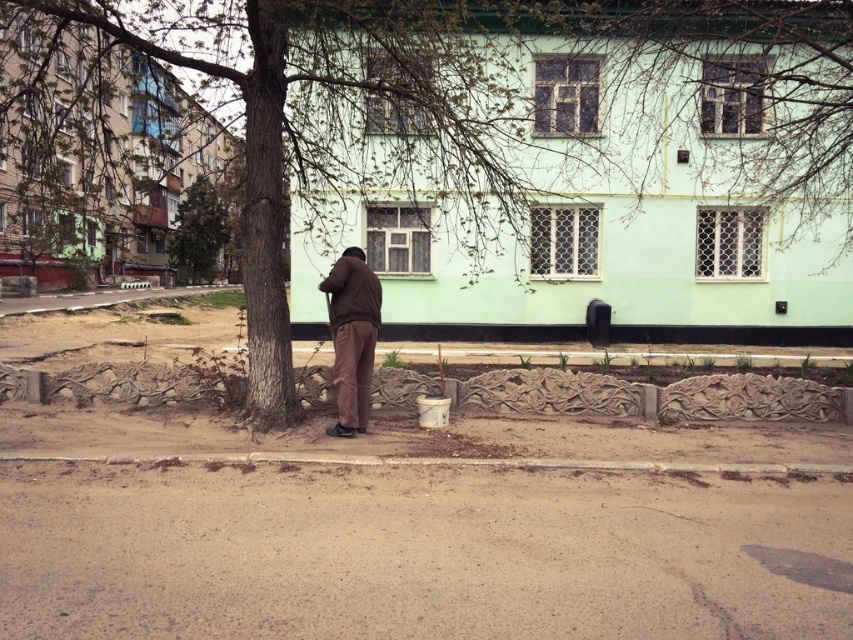
Can you confirm if brown matte jacket at center is positioned below green leafy tree at upper left?

Correct, brown matte jacket at center is located below green leafy tree at upper left.

Is brown matte jacket at center thinner than green leafy tree at upper left?

Yes, brown matte jacket at center is thinner than green leafy tree at upper left.

Is point (346, 400) positioned in front of point (183, 259)?

That is True.

The height and width of the screenshot is (640, 853). In order to click on brown matte jacket at center in this screenshot , I will do `click(352, 337)`.

Can you confirm if brown bark tree at center is wider than brown matte jacket at center?

Yes, brown bark tree at center is wider than brown matte jacket at center.

What do you see at coordinates (503, 122) in the screenshot?
I see `brown bark tree at center` at bounding box center [503, 122].

Is point (531, 20) farther from camera compared to point (364, 412)?

Yes, point (531, 20) is farther from viewer.

The height and width of the screenshot is (640, 853). In order to click on brown bark tree at center in this screenshot , I will do `click(503, 122)`.

Can you confirm if brown bark tree at center is positioned to the left of green leafy tree at upper left?

Incorrect, brown bark tree at center is not on the left side of green leafy tree at upper left.

Does brown bark tree at center appear under green leafy tree at upper left?

Yes.

Which is in front, point (245, 125) or point (194, 241)?

Point (245, 125)

Locate an element on the screen. This screenshot has width=853, height=640. brown bark tree at center is located at coordinates (503, 122).